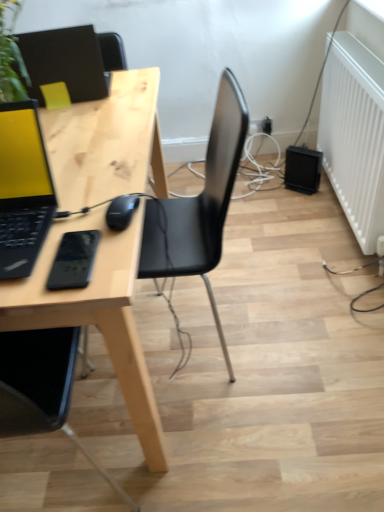
I want to click on free space in front of black matte mouse at center, so click(99, 263).